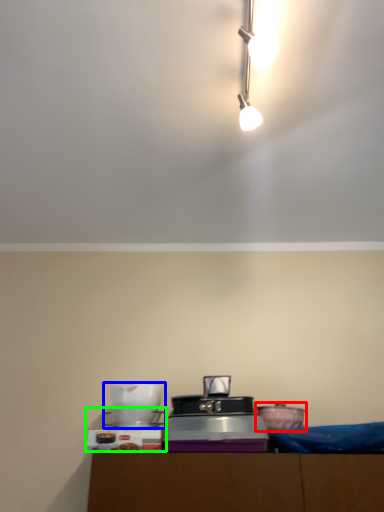
Question: Based on their relative distances, which object is nearer to appliance (highlighted by a red box)? Choose from appliance (highlighted by a blue box) and appliance (highlighted by a green box).

Choices:
 (A) appliance
 (B) appliance

Answer: (A)